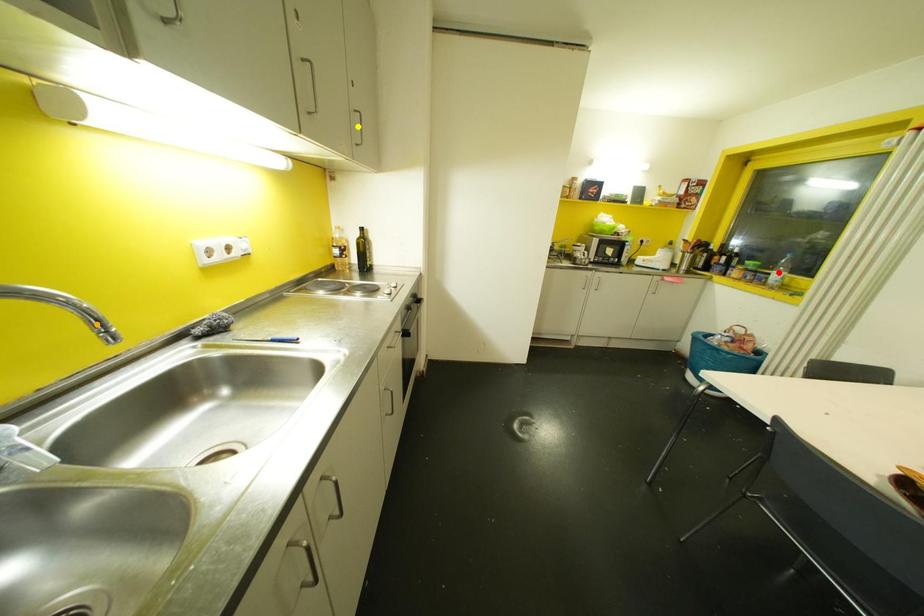
Order these from farthest to nearest:
yellow point | red point | orange point

red point, yellow point, orange point